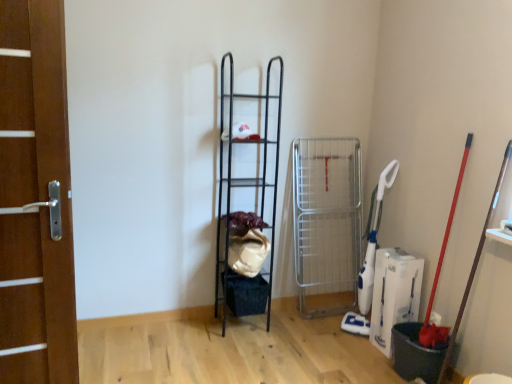
Question: Can you confirm if wooden door at left is wider than black metal shelf at center?

Choices:
 (A) no
 (B) yes

Answer: (A)

Question: Could black metal shelf at center be considered to be inside wooden door at left?

Choices:
 (A) yes
 (B) no

Answer: (B)

Question: Does wooden door at left have a smaller size compared to black metal shelf at center?

Choices:
 (A) no
 (B) yes

Answer: (B)

Question: Is wooden door at left oriented away from black metal shelf at center?

Choices:
 (A) no
 (B) yes

Answer: (A)

Question: Would you say wooden door at left is outside black metal shelf at center?

Choices:
 (A) yes
 (B) no

Answer: (A)

Question: Does wooden door at left appear on the left side of black metal shelf at center?

Choices:
 (A) no
 (B) yes

Answer: (B)

Question: From the image's perspective, is black metal shelf at center on wooden door at left?

Choices:
 (A) no
 (B) yes

Answer: (B)

Question: Considering the relative positions of black metal shelf at center and wooden door at left in the image provided, is black metal shelf at center to the left of wooden door at left from the viewer's perspective?

Choices:
 (A) yes
 (B) no

Answer: (B)

Question: Can you confirm if black metal shelf at center is smaller than wooden door at left?

Choices:
 (A) no
 (B) yes

Answer: (A)

Question: Does black metal shelf at center have a greater width compared to wooden door at left?

Choices:
 (A) no
 (B) yes

Answer: (B)

Question: Does black metal shelf at center have a greater height compared to wooden door at left?

Choices:
 (A) no
 (B) yes

Answer: (B)

Question: Can you confirm if black metal shelf at center is thinner than wooden door at left?

Choices:
 (A) yes
 (B) no

Answer: (B)

Question: Is wooden door at left inside the boundaries of black metal shelf at center, or outside?

Choices:
 (A) outside
 (B) inside

Answer: (A)